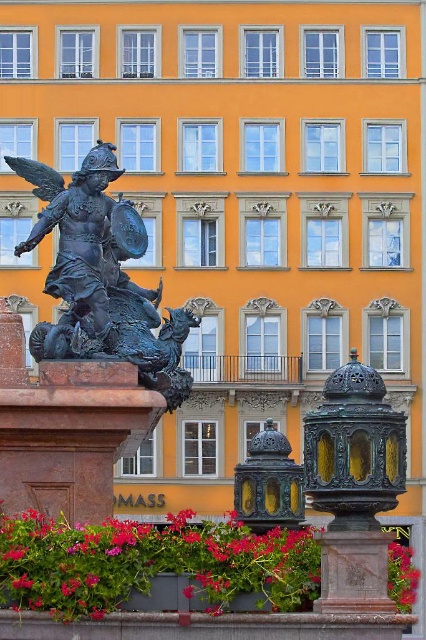
You are standing in the urban scene and notice a point marked at coordinates (152,564). According to the image, what is this point located on?

The point at (152,564) is located on vivid pink petals at lower center.